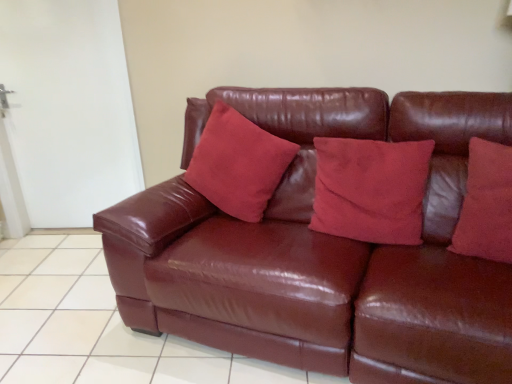
Question: Is shiny brown leather couch at center facing towards glossy leather couch at center?

Choices:
 (A) no
 (B) yes

Answer: (A)

Question: Does shiny brown leather couch at center have a greater height compared to glossy leather couch at center?

Choices:
 (A) yes
 (B) no

Answer: (A)

Question: Can you confirm if shiny brown leather couch at center is positioned to the right of glossy leather couch at center?

Choices:
 (A) no
 (B) yes

Answer: (B)

Question: Is shiny brown leather couch at center closer to camera compared to glossy leather couch at center?

Choices:
 (A) no
 (B) yes

Answer: (B)

Question: Is shiny brown leather couch at center not within glossy leather couch at center?

Choices:
 (A) yes
 (B) no

Answer: (A)

Question: From a real-world perspective, does shiny brown leather couch at center stand above glossy leather couch at center?

Choices:
 (A) yes
 (B) no

Answer: (A)

Question: Is glossy leather couch at center shorter than suede-like red pillow at center, the 3th pillow when ordered from right to left?

Choices:
 (A) no
 (B) yes

Answer: (B)

Question: From a real-world perspective, is glossy leather couch at center over suede-like red pillow at center, the 3th pillow when ordered from right to left?

Choices:
 (A) no
 (B) yes

Answer: (A)

Question: Is glossy leather couch at center to the left of suede-like red pillow at center, the 3th pillow when ordered from right to left, from the viewer's perspective?

Choices:
 (A) yes
 (B) no

Answer: (A)

Question: Does glossy leather couch at center have a larger size compared to suede-like red pillow at center, the 3th pillow when ordered from right to left?

Choices:
 (A) no
 (B) yes

Answer: (B)

Question: Does glossy leather couch at center have a greater width compared to suede-like red pillow at center, the 3th pillow when ordered from right to left?

Choices:
 (A) yes
 (B) no

Answer: (A)

Question: Would you say glossy leather couch at center is a long distance from suede-like red pillow at center, the 3th pillow when ordered from right to left?

Choices:
 (A) yes
 (B) no

Answer: (B)

Question: Is suede-like red pillow at right, which is counted as the 1th pillow, starting from the right, not within shiny brown leather couch at center?

Choices:
 (A) no
 (B) yes

Answer: (A)